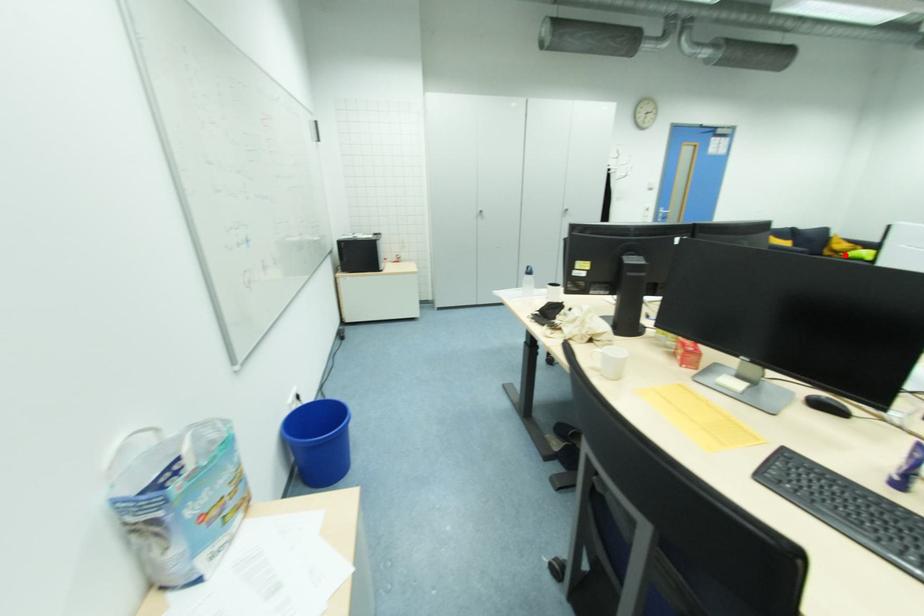
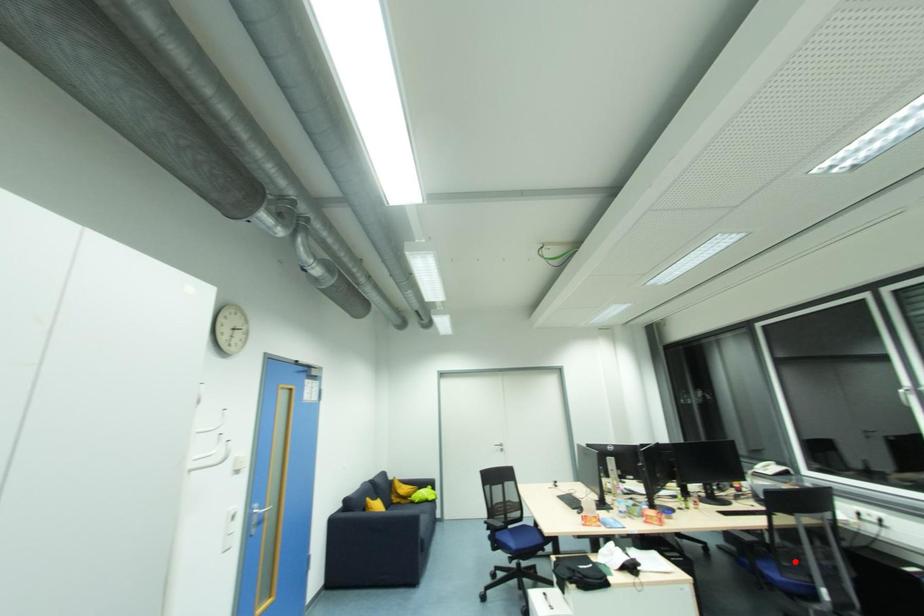
I am providing you with two images of the same scene from different viewpoints. A red point is marked on the first image and another point is marked on the second image. Do the highlighted points in image1 and image2 indicate the same real-world spot?

No